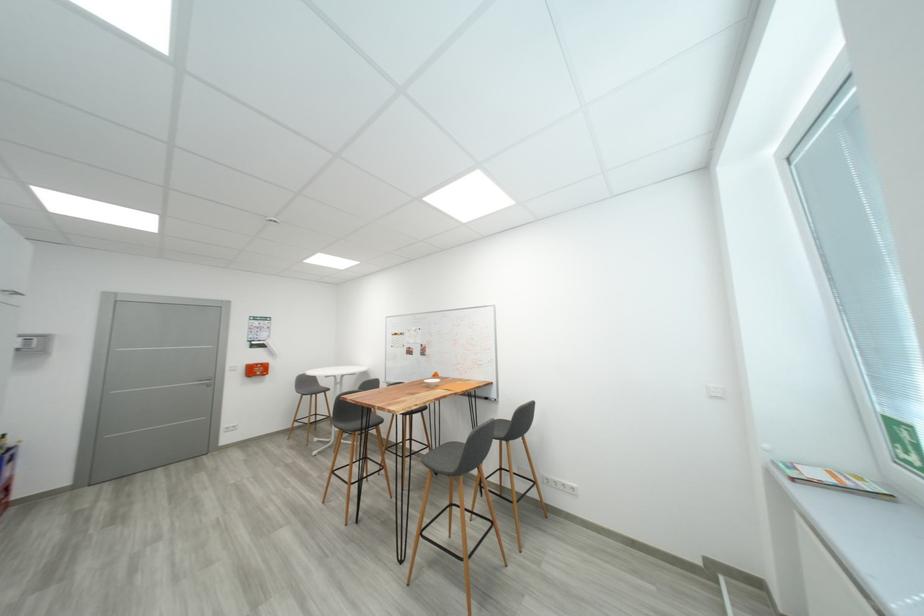
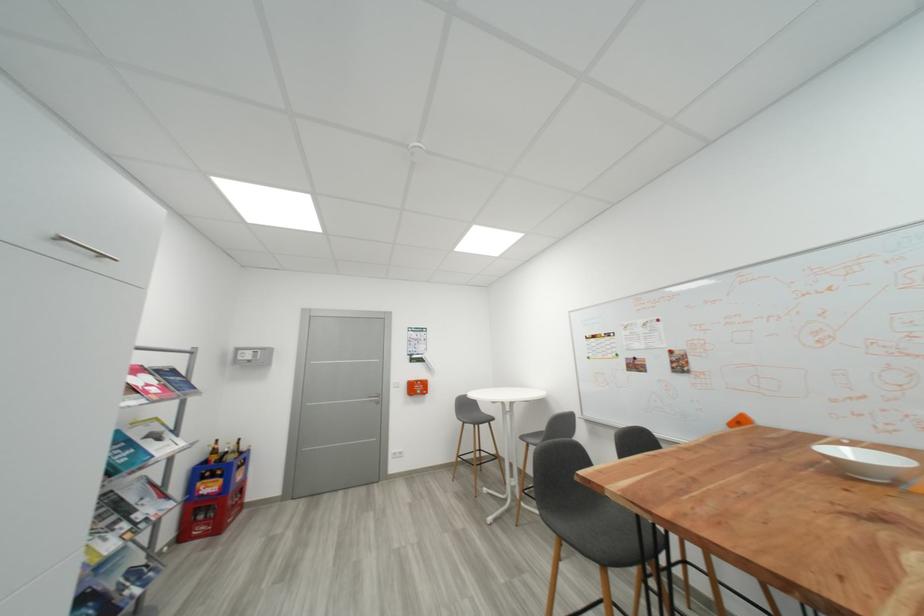
The point at (298, 448) is marked in the first image. Where is the corresponding point in the second image?

(465, 496)